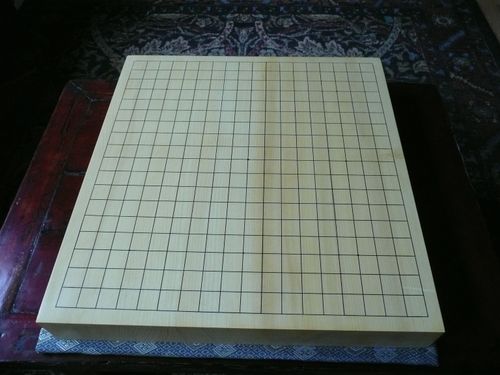
You are a GUI agent. You are given a task and a screenshot of the screen. Output one action in this format:
    pyautogui.click(x=<x>, y=<y>)
    Task: Click on the linen pattern
    
    Given the screenshot: What is the action you would take?
    pyautogui.click(x=259, y=348)